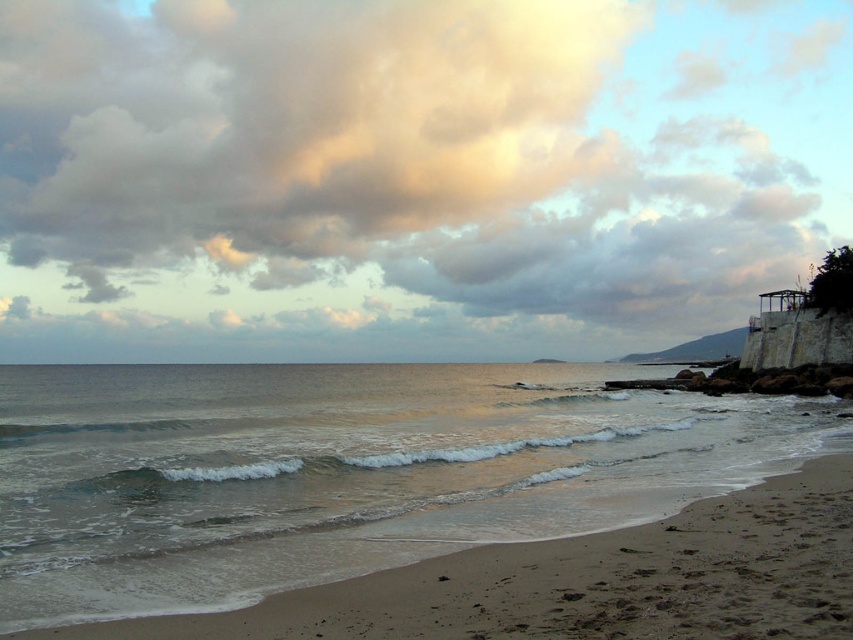
Question: Does cloudy sky at upper center appear under sandy beach at lower left?

Choices:
 (A) yes
 (B) no

Answer: (B)

Question: Does cloudy sky at upper center come in front of sandy beach at lower left?

Choices:
 (A) no
 (B) yes

Answer: (A)

Question: Which of the following is the closest to the observer?

Choices:
 (A) sandy beach at lower left
 (B) cloudy sky at upper center

Answer: (A)

Question: Does cloudy sky at upper center have a lesser width compared to sandy beach at lower left?

Choices:
 (A) yes
 (B) no

Answer: (B)